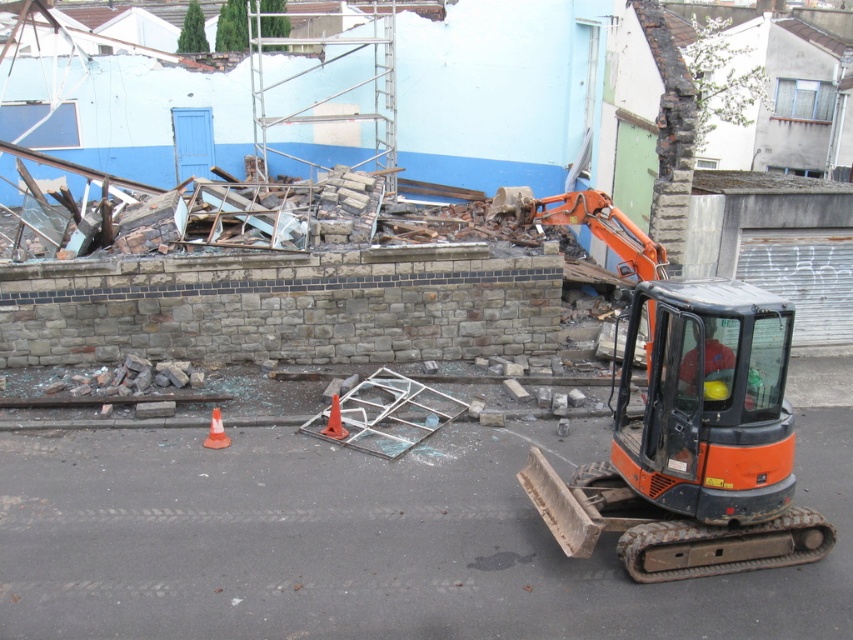
Question: Does orange plastic cone at center lie behind orange plastic cone at lower center?

Choices:
 (A) yes
 (B) no

Answer: (A)

Question: Which of these objects is positioned closest to the orange plastic cone at lower center?

Choices:
 (A) orange plastic cone at center
 (B) orange metallic excavator at center

Answer: (A)

Question: Is orange hard hat at center behind orange plastic cone at center?

Choices:
 (A) yes
 (B) no

Answer: (B)

Question: Does orange metallic excavator at center lie in front of orange plastic cone at lower center?

Choices:
 (A) yes
 (B) no

Answer: (A)

Question: Estimate the real-world distances between objects in this image. Which object is farther from the orange metallic excavator at center?

Choices:
 (A) orange plastic cone at center
 (B) orange hard hat at center
 (C) orange plastic cone at lower center

Answer: (C)

Question: Among these objects, which one is farthest from the camera?

Choices:
 (A) orange metallic excavator at center
 (B) orange plastic cone at center
 (C) orange plastic cone at lower center
 (D) orange hard hat at center

Answer: (B)